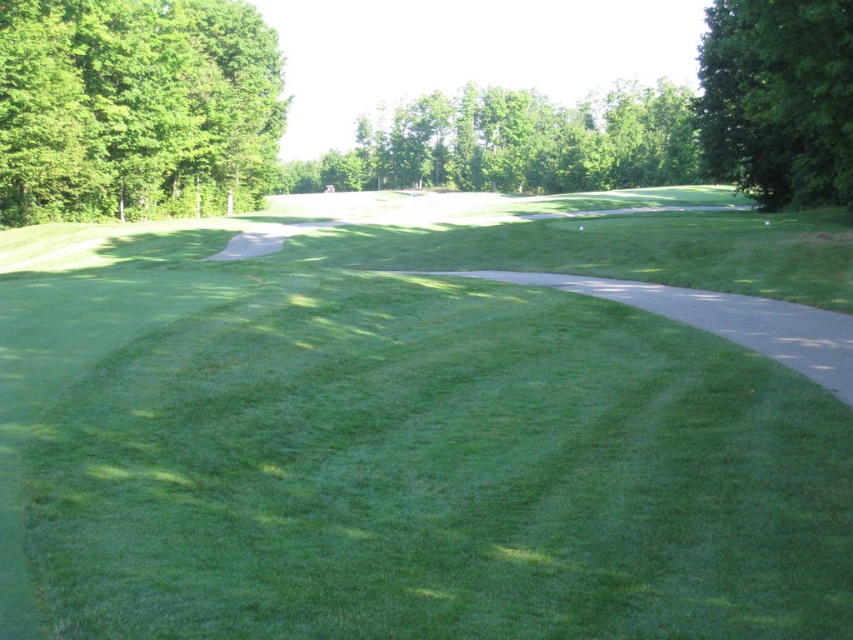
You are a golfer standing on the fairway and see the green leafy tree at left and the green leafy tree at upper center. Which tree is positioned more to the left side of the scene?

The green leafy tree at left is positioned more to the left side of the scene compared to the green leafy tree at upper center.

You are a golfer standing on the fairway and want to determine which tree you can see taller between the green leafy tree at left and the green leafy tree at upper center. Which one is taller?

The green leafy tree at upper center is taller than the green leafy tree at left.